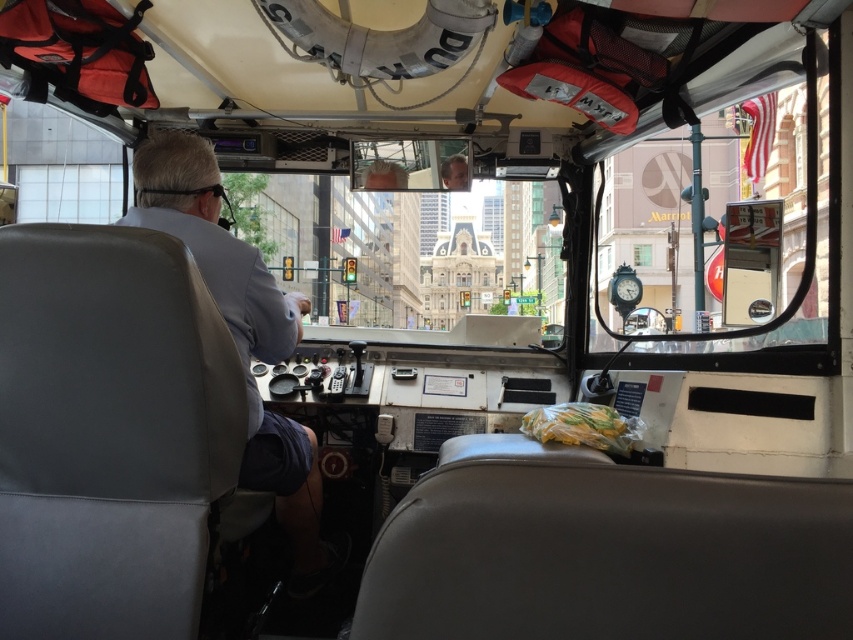
You are a passenger on the bus and want to know if you can reach the clear glass window at center from your current position near the white leather jacket at left without moving more than 45 meters. Can you do it?

The distance between the white leather jacket at left and the clear glass window at center is 46.36 meters. Since this distance exceeds 45 meters, you cannot reach the clear glass window at center without moving more than 45 meters.